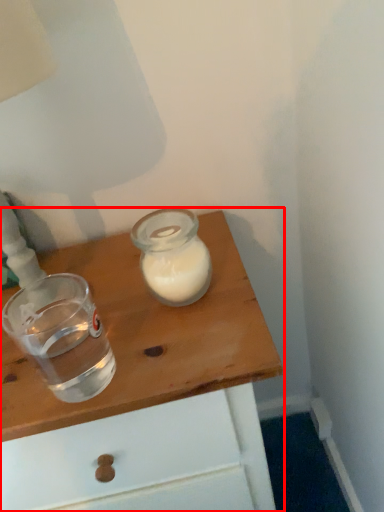
Question: Considering the relative positions of table (annotated by the red box) and shot glass in the image provided, where is table (annotated by the red box) located with respect to the staircase?

Choices:
 (A) right
 (B) left

Answer: (A)